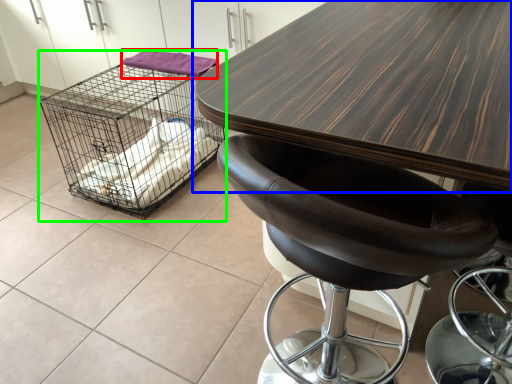
Question: Estimate the real-world distances between objects in this image. Which object is farther from material (highlighted by a red box), table (highlighted by a blue box) or bird cage (highlighted by a green box)?

Choices:
 (A) table
 (B) bird cage

Answer: (A)